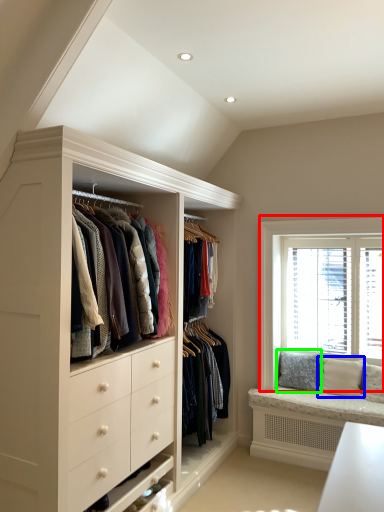
Question: Which object is positioned farthest from window (highlighted by a red box)? Select from pillow (highlighted by a blue box) and pillow (highlighted by a green box).

Choices:
 (A) pillow
 (B) pillow

Answer: (A)